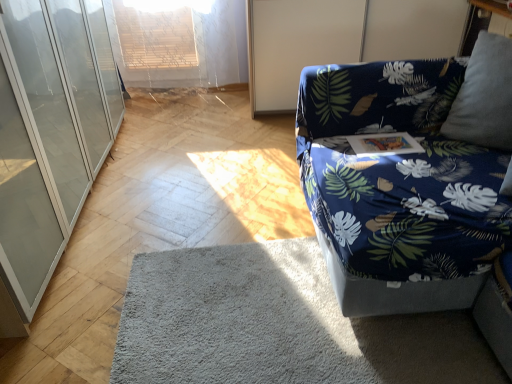
Find the location of `transparent glass cabinet at left`. transparent glass cabinet at left is located at coordinates (50, 131).

This screenshot has width=512, height=384. What do you see at coordinates (298, 45) in the screenshot? I see `blue fabric screen door at upper right` at bounding box center [298, 45].

The width and height of the screenshot is (512, 384). What are the coordinates of `transparent glass cabinet at left` in the screenshot? It's located at (50, 131).

Is gray soft rug at lower center placed right next to blue fabric couch at right?

There is a gap between gray soft rug at lower center and blue fabric couch at right.

Is gray soft rug at lower center looking in the opposite direction of blue fabric couch at right?

No, blue fabric couch at right is not at the back of gray soft rug at lower center.

Is gray soft rug at lower center bigger than blue fabric couch at right?

Actually, gray soft rug at lower center might be smaller than blue fabric couch at right.

From a real-world perspective, which object rests below the other?

gray soft rug at lower center, from a real-world perspective.

Could you tell me if gray soft rug at lower center is turned towards blue fabric screen door at upper right?

No, gray soft rug at lower center is not facing towards blue fabric screen door at upper right.

Is gray soft rug at lower center in front of or behind blue fabric screen door at upper right in the image?

gray soft rug at lower center is in front of blue fabric screen door at upper right.

From the image's perspective, who appears lower, gray soft rug at lower center or blue fabric screen door at upper right?

From the image's view, gray soft rug at lower center is below.

From a real-world perspective, is blue fabric couch at right positioned over transparent glass cabinet at left based on gravity?

No, from a real-world perspective, blue fabric couch at right is not above transparent glass cabinet at left.

Would you say blue fabric couch at right is outside transparent glass cabinet at left?

Yes.

Between blue fabric couch at right and transparent glass cabinet at left, which one is positioned in front?

Positioned in front is transparent glass cabinet at left.

Does blue fabric screen door at upper right have a larger size compared to blue fabric couch at right?

Actually, blue fabric screen door at upper right might be smaller than blue fabric couch at right.

From a real-world perspective, between blue fabric screen door at upper right and blue fabric couch at right, who is vertically higher?

blue fabric screen door at upper right.

Between blue fabric screen door at upper right and blue fabric couch at right, which one has smaller width?

With smaller width is blue fabric screen door at upper right.

Is blue fabric screen door at upper right situated inside blue fabric couch at right or outside?

blue fabric screen door at upper right exists outside the volume of blue fabric couch at right.

Locate an element on the screen. glass door on the left of gray soft rug at lower center is located at coordinates (50, 131).

Does point (17, 113) come closer to viewer compared to point (153, 353)?

No, (17, 113) is further to viewer.

Does transparent glass cabinet at left have a lesser height compared to gray soft rug at lower center?

No.

Measure the distance between transparent glass cabinet at left and gray soft rug at lower center.

transparent glass cabinet at left and gray soft rug at lower center are 34.81 inches apart from each other.

How much distance is there between gray soft rug at lower center and transparent glass cabinet at left?

They are 88.42 centimeters apart.

Considering the positions of objects gray soft rug at lower center and transparent glass cabinet at left in the image provided, who is behind, gray soft rug at lower center or transparent glass cabinet at left?

gray soft rug at lower center.

Is gray soft rug at lower center not close to transparent glass cabinet at left?

No, gray soft rug at lower center is not far from transparent glass cabinet at left.

Would you say transparent glass cabinet at left is part of gray soft rug at lower center's contents?

That's incorrect, transparent glass cabinet at left is not inside gray soft rug at lower center.

Image resolution: width=512 pixels, height=384 pixels. I want to click on screen door below the transparent glass cabinet at left (from a real-world perspective), so click(298, 45).

Does point (23, 21) come behind point (284, 38)?

No, (23, 21) is in front of (284, 38).

From the image's perspective, is transparent glass cabinet at left located above blue fabric screen door at upper right?

No, from the image's perspective, transparent glass cabinet at left is not over blue fabric screen door at upper right.

From a real-world perspective, which object stands above the other?

transparent glass cabinet at left.

Locate an element on the screen. The height and width of the screenshot is (384, 512). studio couch on the right of gray soft rug at lower center is located at coordinates (409, 176).

Find the location of a particular element. The width and height of the screenshot is (512, 384). mat below the blue fabric screen door at upper right (from a real-world perspective) is located at coordinates (278, 326).

Looking at the image, which one is located further to blue fabric couch at right, transparent glass cabinet at left or blue fabric screen door at upper right?

transparent glass cabinet at left.

When comparing their distances from blue fabric couch at right, does transparent glass cabinet at left or gray soft rug at lower center seem closer?

gray soft rug at lower center is positioned closer to the anchor blue fabric couch at right.

From the image, which object appears to be nearer to blue fabric screen door at upper right, gray soft rug at lower center or blue fabric couch at right?

Based on the image, blue fabric couch at right appears to be nearer to blue fabric screen door at upper right.

Looking at the image, which one is located further to blue fabric screen door at upper right, transparent glass cabinet at left or blue fabric couch at right?

transparent glass cabinet at left is further to blue fabric screen door at upper right.

Looking at the image, which one is located further to gray soft rug at lower center, blue fabric screen door at upper right or blue fabric couch at right?

blue fabric screen door at upper right lies further to gray soft rug at lower center than the other object.

Based on their spatial positions, is blue fabric couch at right or gray soft rug at lower center closer to transparent glass cabinet at left?

gray soft rug at lower center.

Looking at the image, which one is located closer to gray soft rug at lower center, transparent glass cabinet at left or blue fabric couch at right?

blue fabric couch at right.

Considering their positions, is transparent glass cabinet at left positioned further to blue fabric screen door at upper right than gray soft rug at lower center?

gray soft rug at lower center is further to blue fabric screen door at upper right.

Where is `mat between blue fabric couch at right and blue fabric screen door at upper right from front to back`? This screenshot has height=384, width=512. mat between blue fabric couch at right and blue fabric screen door at upper right from front to back is located at coordinates (278, 326).

I want to click on screen door between transparent glass cabinet at left and blue fabric couch at right, so click(298, 45).

Identify the location of mat situated between transparent glass cabinet at left and blue fabric screen door at upper right from left to right. The width and height of the screenshot is (512, 384). (278, 326).

At what (x,y) coordinates should I click in order to perform the action: click on mat situated between transparent glass cabinet at left and blue fabric couch at right from left to right. Please return your answer as a coordinate pair (x, y). The width and height of the screenshot is (512, 384). Looking at the image, I should click on point(278,326).